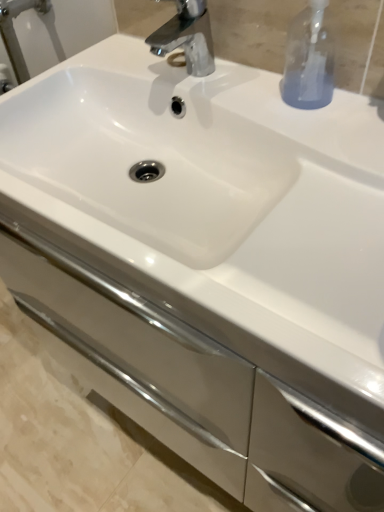
Locate an element on the screen. The image size is (384, 512). spots to the right of polished chrome faucet at upper center is located at coordinates (256, 89).